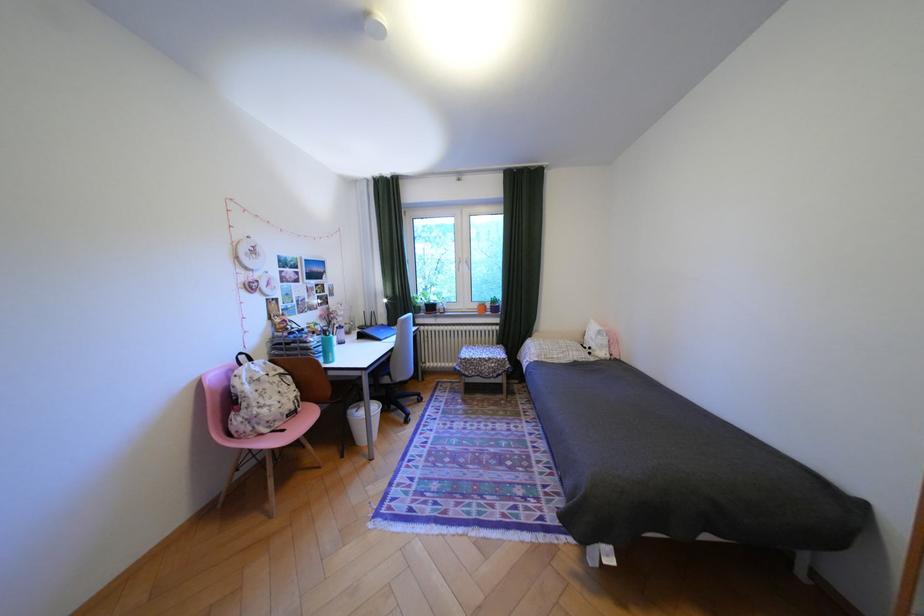
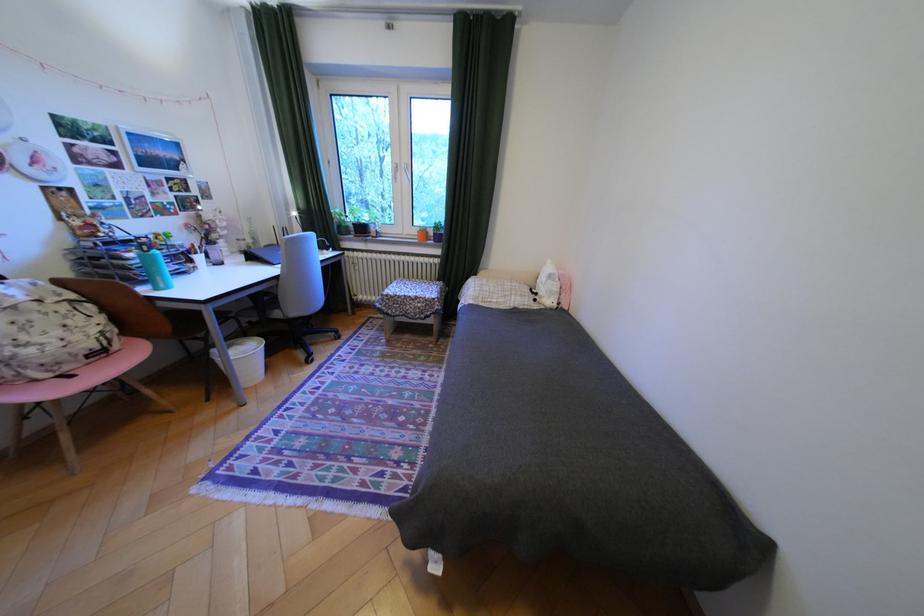
Question: I am providing you with two images of the same scene from different viewpoints. Please identify which objects are invisible in image2.

Choices:
 (A) pink chair sitting surface
 (B) blue chair sitting surface
 (C) purple flower pot
 (D) none of these

Answer: (D)